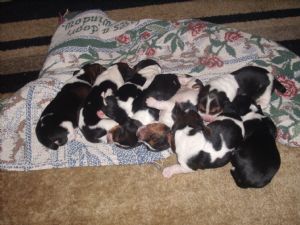
This screenshot has width=300, height=225. Find the location of `flower design on quilt`. flower design on quilt is located at coordinates (121, 37), (213, 64), (293, 85).